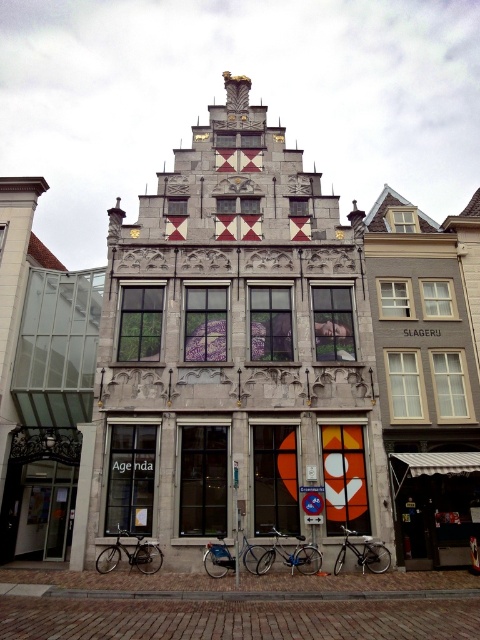
Is white canvas awning at lower right below shiny metallic bicycle at center?

No, white canvas awning at lower right is not below shiny metallic bicycle at center.

This screenshot has width=480, height=640. What are the coordinates of `white canvas awning at lower right` in the screenshot? It's located at click(x=434, y=506).

The height and width of the screenshot is (640, 480). Find the location of `white canvas awning at lower right`. white canvas awning at lower right is located at coordinates (434, 506).

Who is positioned more to the left, white canvas awning at lower right or silver metallic bicycle at lower left?

Positioned to the left is silver metallic bicycle at lower left.

Between point (479, 481) and point (99, 572), which one is positioned in front?

Point (99, 572)

Does point (479, 516) come closer to viewer compared to point (149, 556)?

No.

Find the location of a particular element. white canvas awning at lower right is located at coordinates click(x=434, y=506).

Can you confirm if white canvas awning at lower right is taller than shiny metallic bicycle at lower center?

Indeed, white canvas awning at lower right has a greater height compared to shiny metallic bicycle at lower center.

Identify the location of white canvas awning at lower right. Image resolution: width=480 pixels, height=640 pixels. (434, 506).

Identify the location of white canvas awning at lower right. (434, 506).